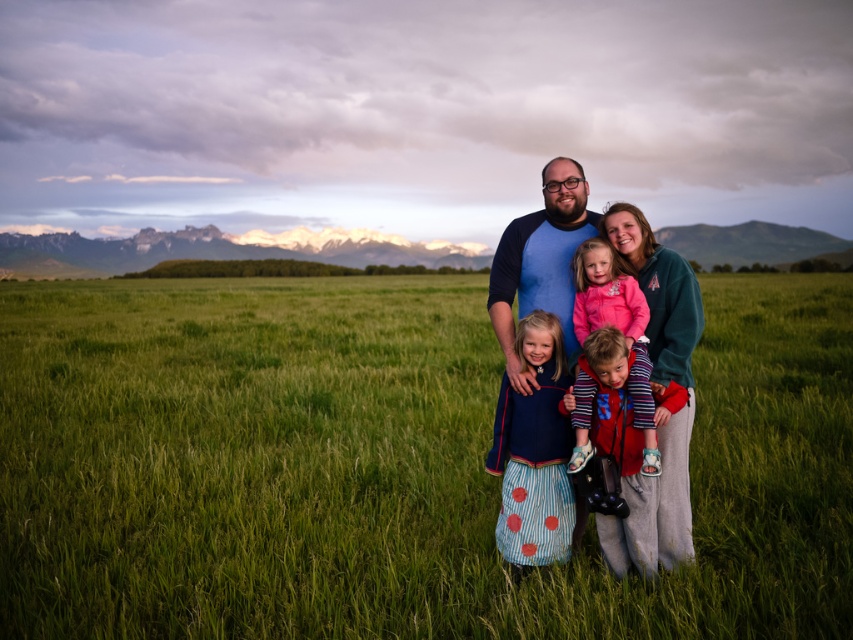
Question: Is blue jersey at center thinner than pink fleece jacket at center?

Choices:
 (A) yes
 (B) no

Answer: (B)

Question: Which point is closer to the camera?

Choices:
 (A) pink fleece jacket at center
 (B) green grassy field at center

Answer: (B)

Question: Which point is closer to the camera?

Choices:
 (A) blue jersey at center
 (B) blue cotton shirt at center
 (C) green grassy field at center

Answer: (C)

Question: Which of the following is the farthest from the observer?

Choices:
 (A) blue jersey at center
 (B) pink fleece jacket at center

Answer: (A)

Question: In this image, where is green grassy field at center located relative to pink fleece jacket at center?

Choices:
 (A) above
 (B) below

Answer: (A)

Question: Can you confirm if blue jersey at center is smaller than pink fleece jacket at center?

Choices:
 (A) yes
 (B) no

Answer: (B)